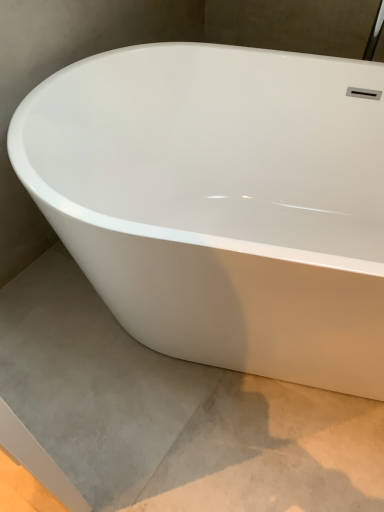
Question: From a real-world perspective, is gray concrete at lower left over white glossy bathtub at center?

Choices:
 (A) yes
 (B) no

Answer: (B)

Question: Could you tell me if gray concrete at lower left is facing white glossy bathtub at center?

Choices:
 (A) no
 (B) yes

Answer: (A)

Question: From a real-world perspective, does gray concrete at lower left sit lower than white glossy bathtub at center?

Choices:
 (A) no
 (B) yes

Answer: (B)

Question: From the image's perspective, is gray concrete at lower left located beneath white glossy bathtub at center?

Choices:
 (A) no
 (B) yes

Answer: (B)

Question: Is gray concrete at lower left wider than white glossy bathtub at center?

Choices:
 (A) no
 (B) yes

Answer: (A)

Question: Is gray concrete at lower left taller than white glossy bathtub at center?

Choices:
 (A) no
 (B) yes

Answer: (A)

Question: Are white glossy bathtub at center and gray concrete at lower left far apart?

Choices:
 (A) no
 (B) yes

Answer: (A)

Question: Can you confirm if white glossy bathtub at center is positioned to the right of gray concrete at lower left?

Choices:
 (A) yes
 (B) no

Answer: (A)

Question: Is white glossy bathtub at center shorter than gray concrete at lower left?

Choices:
 (A) no
 (B) yes

Answer: (A)

Question: Is white glossy bathtub at center oriented away from gray concrete at lower left?

Choices:
 (A) no
 (B) yes

Answer: (A)

Question: From the image's perspective, does white glossy bathtub at center appear higher than gray concrete at lower left?

Choices:
 (A) no
 (B) yes

Answer: (B)

Question: From a real-world perspective, is white glossy bathtub at center beneath gray concrete at lower left?

Choices:
 (A) yes
 (B) no

Answer: (B)

Question: From a real-world perspective, is white glossy bathtub at center physically located above or below gray concrete at lower left?

Choices:
 (A) below
 (B) above

Answer: (B)